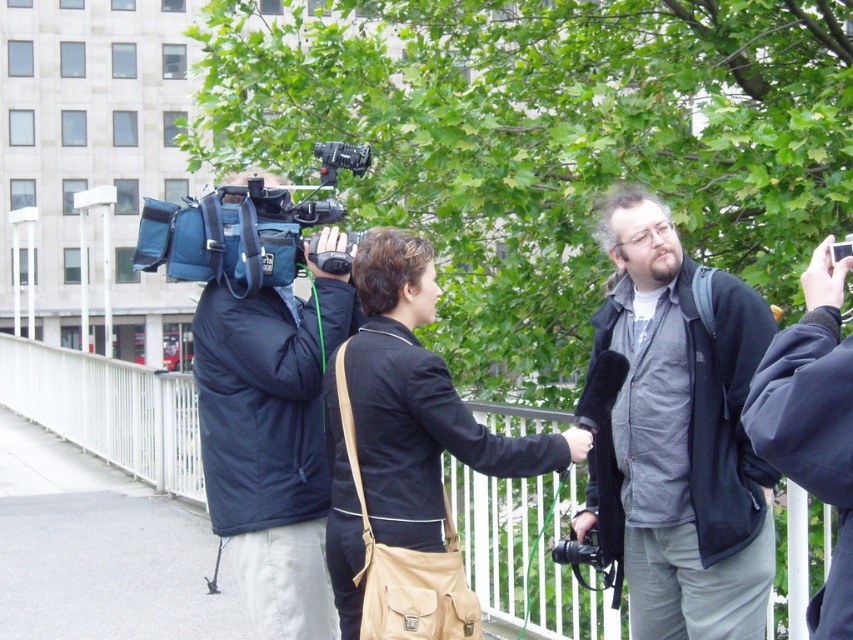
You are a photographer at the scene. You want to take a photo of the black puffy jacket at left without including the white metal fence at center in the frame. Is this possible?

The black puffy jacket at left is behind the white metal fence at center, so it is possible to position the camera to capture the black puffy jacket at left while excluding the white metal fence at center from the frame by adjusting the angle or moving closer.

You are a photographer at the scene. You need to position yourself so that the white metal fence at center is between you and the black puffy jacket at left. Is this possible based on their current positions?

The white metal fence at center is to the left of the black puffy jacket at left, so positioning yourself so that the white metal fence is between you and the black puffy jacket would require placing yourself to the right of the fence. However, since the fence is already to the left of the jacket, this arrangement is possible. Therefore, yes, you can position yourself such that the white metal fence at center is between you and the black puffy jacket at left.